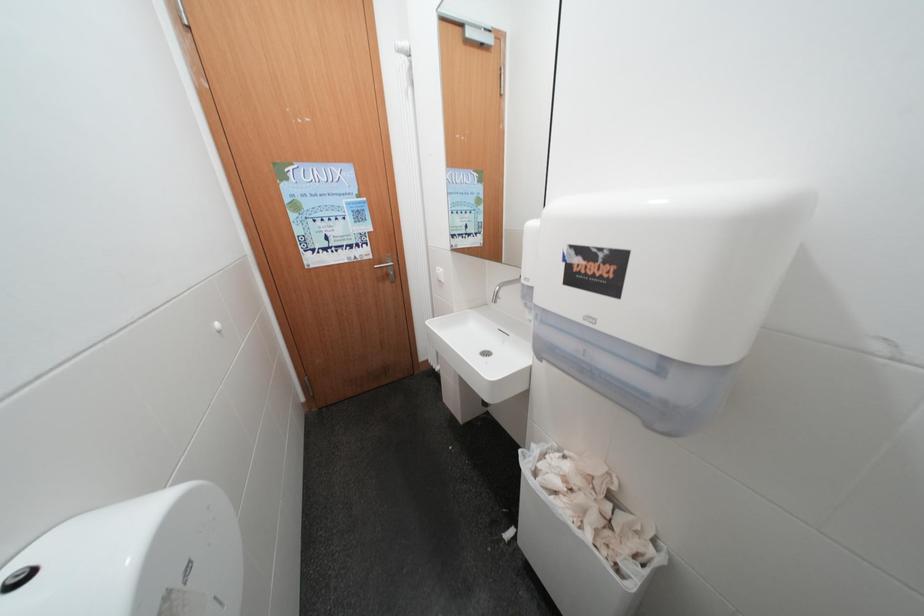
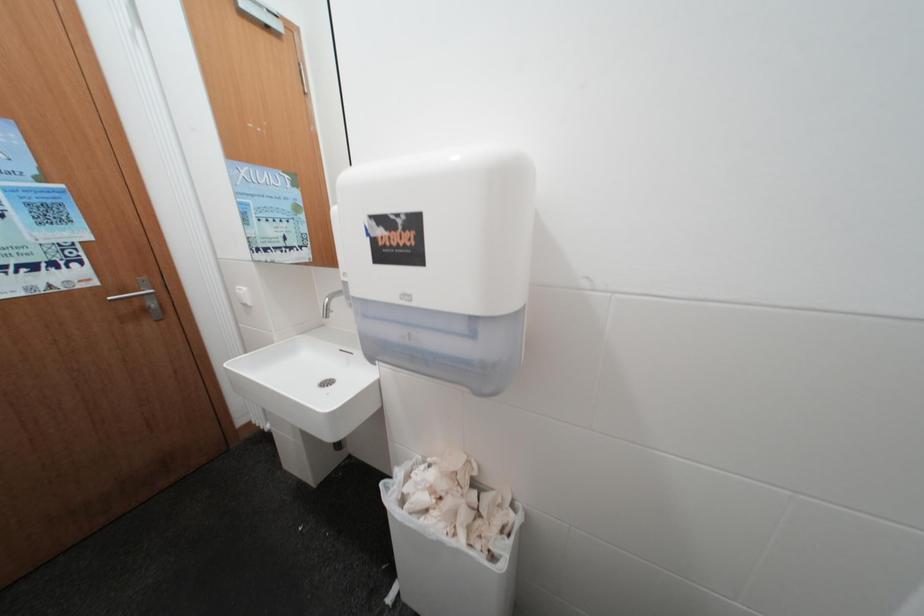
Question: Based on the continuous images, in which direction is the camera rotating? Reply with the corresponding letter.

Choices:
 (A) Left
 (B) Right
 (C) Up
 (D) Down

Answer: (B)